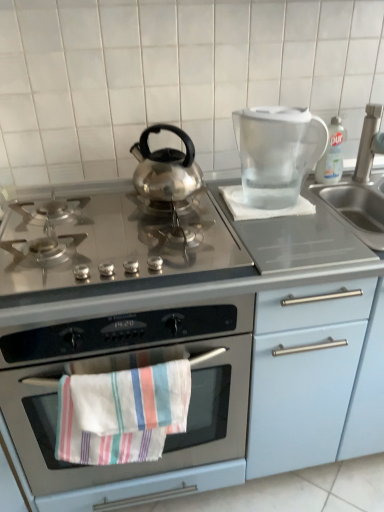
Question: From the image's perspective, is stainless steel gas stove at center above or below transparent plastic pitcher at upper right?

Choices:
 (A) below
 (B) above

Answer: (A)

Question: In the image, is stainless steel gas stove at center on the left side or the right side of transparent plastic pitcher at upper right?

Choices:
 (A) right
 (B) left

Answer: (B)

Question: Which of these objects is positioned farthest from the satin nickel faucet at right?

Choices:
 (A) clear plastic bottle at upper right
 (B) striped cotton towel at center
 (C) stainless steel gas stove at center
 (D) transparent plastic pitcher at upper right
 (E) stainless steel oven at center

Answer: (B)

Question: Which object is the closest to the transparent plastic pitcher at upper right?

Choices:
 (A) stainless steel oven at center
 (B) clear plastic bottle at upper right
 (C) stainless steel gas stove at center
 (D) satin nickel faucet at right
 (E) striped cotton towel at center

Answer: (B)